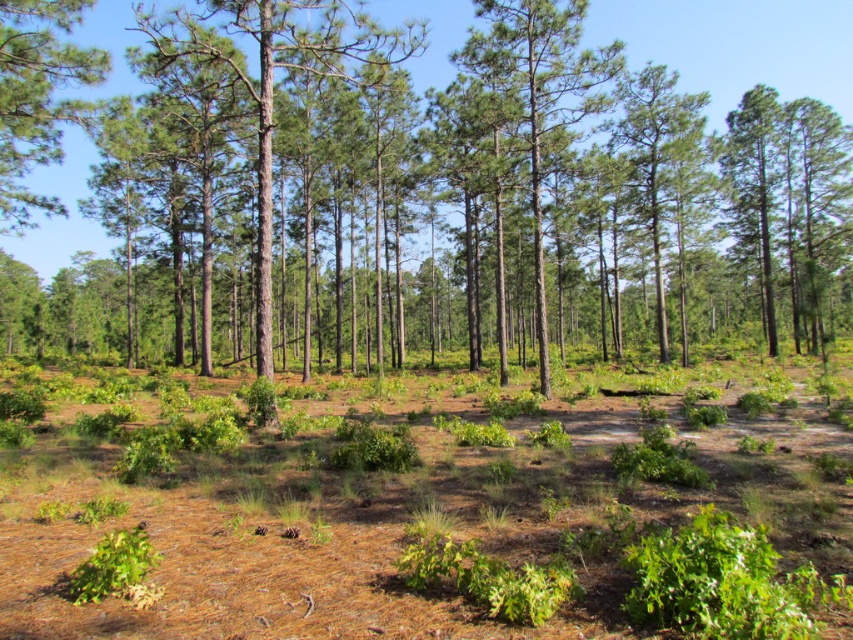
Question: Which point appears closest to the camera in this image?

Choices:
 (A) (474, 40)
 (B) (28, 195)
 (C) (229, 6)

Answer: (C)

Question: Observing the image, what is the correct spatial positioning of green textured tree at center in reference to green textured pine tree at center?

Choices:
 (A) right
 (B) left

Answer: (A)

Question: Considering the real-world distances, which object is closest to the smooth brown tree trunk at center?

Choices:
 (A) green textured tree at center
 (B) green textured pine tree at center

Answer: (B)

Question: Is smooth brown tree trunk at center further to camera compared to green textured pine tree at center?

Choices:
 (A) no
 (B) yes

Answer: (A)

Question: Is smooth brown tree trunk at center smaller than green textured pine tree at center?

Choices:
 (A) no
 (B) yes

Answer: (B)

Question: Among these objects, which one is farthest from the camera?

Choices:
 (A) green bark tree at upper left
 (B) green textured pine tree at center

Answer: (B)